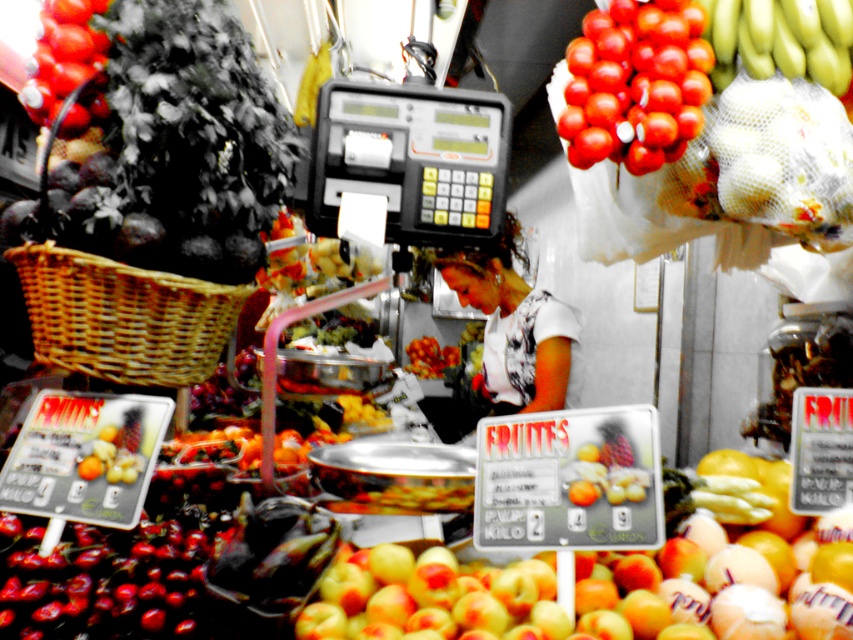
In the scene shown: Can you confirm if black plastic scale at center is positioned below woven brown basket at lower left?

No.

Is point (346, 112) positioned behind point (80, 296)?

Yes, point (346, 112) is farther from viewer.

Locate an element on the screen. black plastic scale at center is located at coordinates (410, 161).

Can you confirm if shiny red tomatoes at upper right is wider than shiny green bananas at upper right?

Incorrect, shiny red tomatoes at upper right's width does not surpass shiny green bananas at upper right's.

Does shiny red tomatoes at upper right have a smaller size compared to shiny green bananas at upper right?

No.

Does point (589, 150) come closer to viewer compared to point (751, 26)?

No, it is not.

The image size is (853, 640). I want to click on shiny red tomatoes at upper right, so click(x=635, y=83).

Is shiny red tomatoes at upper right taller than smooth red tomato at upper left?

Indeed, shiny red tomatoes at upper right has a greater height compared to smooth red tomato at upper left.

From the picture: Can you confirm if shiny red tomatoes at upper right is wider than smooth red tomato at upper left?

Yes, shiny red tomatoes at upper right is wider than smooth red tomato at upper left.

You are a GUI agent. You are given a task and a screenshot of the screen. Output one action in this format:
    pyautogui.click(x=<x>, y=<y>)
    Task: Click on the shiny red tomatoes at upper right
    The width and height of the screenshot is (853, 640).
    Given the screenshot: What is the action you would take?
    pyautogui.click(x=635, y=83)